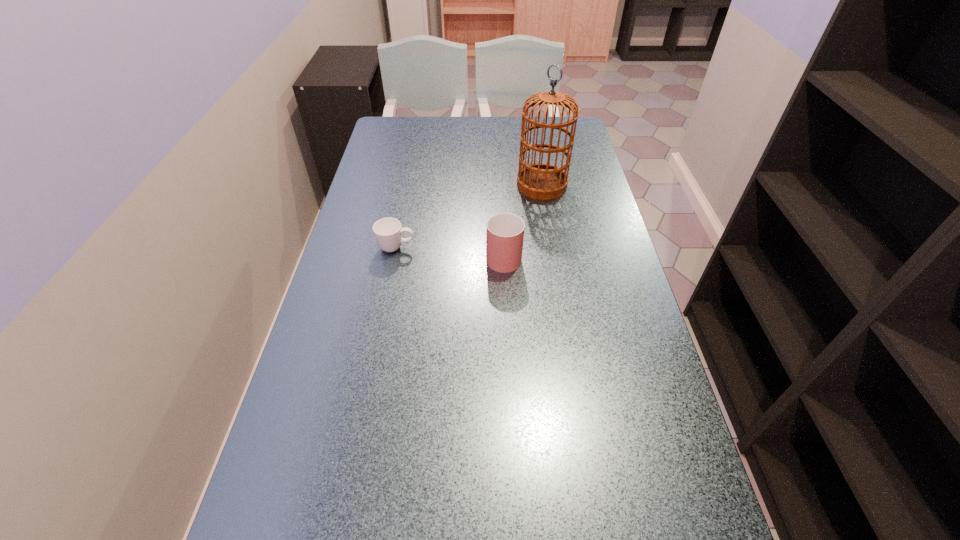
This screenshot has height=540, width=960. I want to click on the rightmost object, so click(x=541, y=181).

Locate an element on the screen. the farthest object is located at coordinates (541, 181).

This screenshot has height=540, width=960. I want to click on the second shortest object, so click(505, 231).

The width and height of the screenshot is (960, 540). In order to click on the right cup in this screenshot , I will do `click(505, 231)`.

Identify the location of the shortest object. This screenshot has width=960, height=540. (388, 232).

Image resolution: width=960 pixels, height=540 pixels. I want to click on the left cup, so click(x=388, y=232).

This screenshot has width=960, height=540. I want to click on vacant region located on the right of the birdcage, so click(588, 185).

You are a GUI agent. You are given a task and a screenshot of the screen. Output one action in this format:
    pyautogui.click(x=<x>, y=<y>)
    Task: Click on the free location located on the side of the second object from right to left with the handle
    Image resolution: width=960 pixels, height=540 pixels.
    Given the screenshot: What is the action you would take?
    pyautogui.click(x=501, y=211)

Image resolution: width=960 pixels, height=540 pixels. In order to click on free location located 0.200m on the side of the second object from right to left with the handle in this screenshot , I will do `click(500, 195)`.

Locate an element on the screen. free region located on the side of the second object from right to left with the handle is located at coordinates (499, 176).